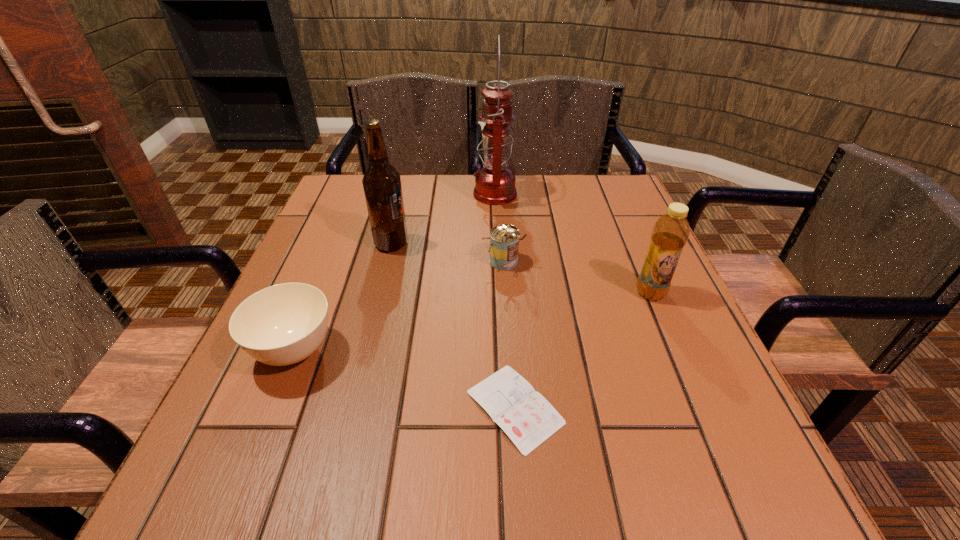
Find the location of `vacant point located between the rightmost object and the leftmost object`. vacant point located between the rightmost object and the leftmost object is located at coordinates (472, 322).

Identify the location of free space between the third tallest object and the beer bottle. This screenshot has height=540, width=960. (521, 268).

Find the location of a particular element. The image size is (960, 540). free space between the tallest object and the fifth tallest object is located at coordinates (395, 272).

Find the location of `free space between the shortest object and the tallest object`. free space between the shortest object and the tallest object is located at coordinates (505, 300).

Locate an element on the screen. free spot between the leftmost object and the tallest object is located at coordinates (395, 272).

Locate an element on the screen. empty space that is in between the shortest object and the third shortest object is located at coordinates (509, 334).

The height and width of the screenshot is (540, 960). Identify the location of object that is the fifth closest to the tallest object. (526, 417).

Identify which object is the fifth closest to the can. Please provide its 2D coordinates. Your answer should be formatted as a tuple, i.e. [(x, y)], where the tuple contains the x and y coordinates of a point satisfying the conditions above.

[(283, 324)]

Find the location of `free space that satisfies the following two spatial constraints: 1. on the label of the third tallest object; 2. on the right side of the second tallest object`. free space that satisfies the following two spatial constraints: 1. on the label of the third tallest object; 2. on the right side of the second tallest object is located at coordinates (379, 293).

Locate an element on the screen. The height and width of the screenshot is (540, 960). free region that satisfies the following two spatial constraints: 1. on the label of the beer bottle; 2. on the right side of the shortest object is located at coordinates (350, 407).